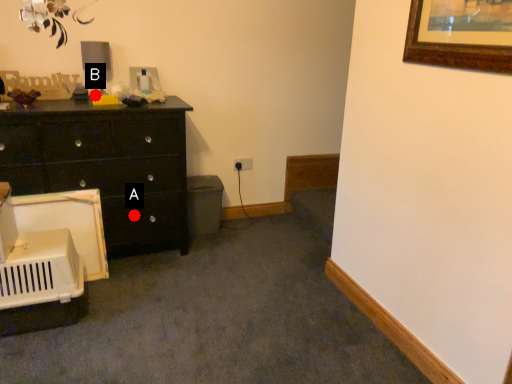
Question: Two points are circled on the image, labeled by A and B beside each circle. Which point is closer to the camera taking this photo?

Choices:
 (A) A is closer
 (B) B is closer

Answer: (A)